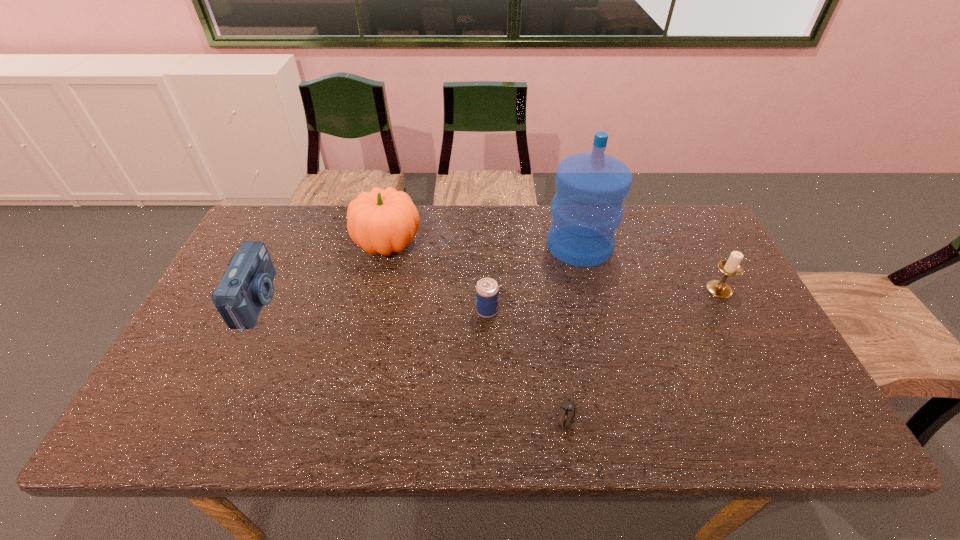
Identify the location of unoccupied position between the rightmost object and the tallest object. This screenshot has width=960, height=540. (649, 267).

Where is `free space between the nearest object and the fifth tallest object`? The image size is (960, 540). free space between the nearest object and the fifth tallest object is located at coordinates (527, 363).

You are a GUI agent. You are given a task and a screenshot of the screen. Output one action in this format:
    pyautogui.click(x=<x>, y=<y>)
    Task: Click on the free spot between the fifth shortest object and the leftmost object
    
    Given the screenshot: What is the action you would take?
    pyautogui.click(x=323, y=272)

This screenshot has height=540, width=960. What are the coordinates of `object that is the third nearest to the nearest object` in the screenshot? It's located at (731, 267).

The width and height of the screenshot is (960, 540). Identify the location of object that is the third nearest to the tallest object. (380, 221).

At what (x,y) coordinates should I click in order to perform the action: click on blank area in the image that satisfies the following two spatial constraints: 1. on the back side of the fifth tallest object; 2. on the left side of the tallest object. Please return your answer as a coordinate pair (x, y). Looking at the image, I should click on (486, 245).

At what (x,y) coordinates should I click in order to perform the action: click on free space in the image that satisfies the following two spatial constraints: 1. on the lens of the camera; 2. on the left side of the beer can. Please return your answer as a coordinate pair (x, y). Image resolution: width=960 pixels, height=540 pixels. Looking at the image, I should click on (252, 311).